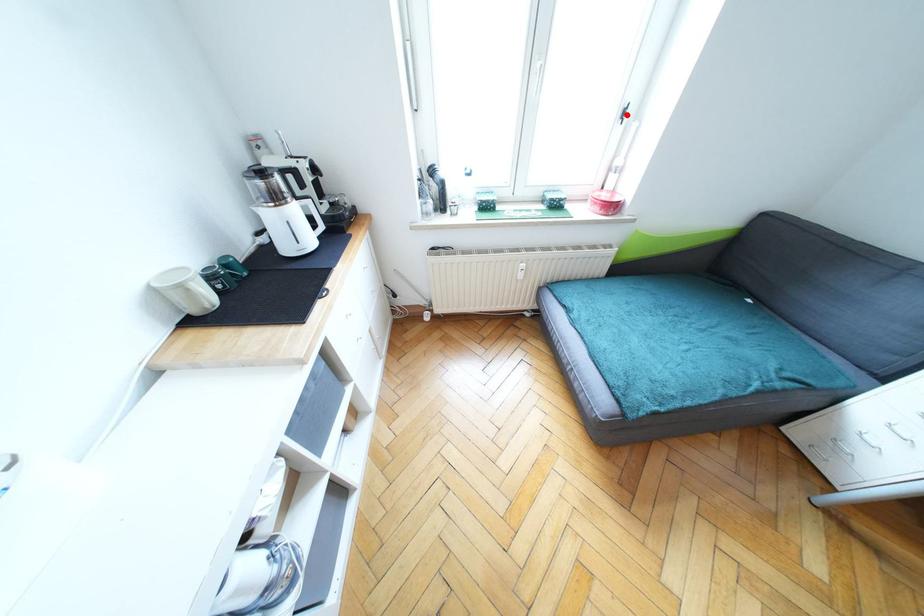
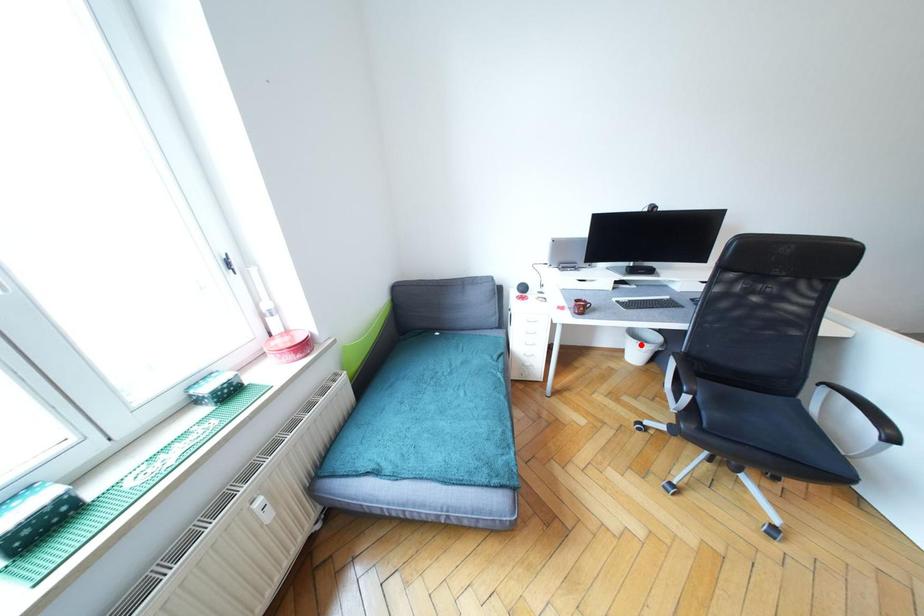
I am providing you with two images of the same scene from different viewpoints. A red point is marked on the first image and another point is marked on the second image. Is the marked point in image1 the same physical position as the marked point in image2?

No